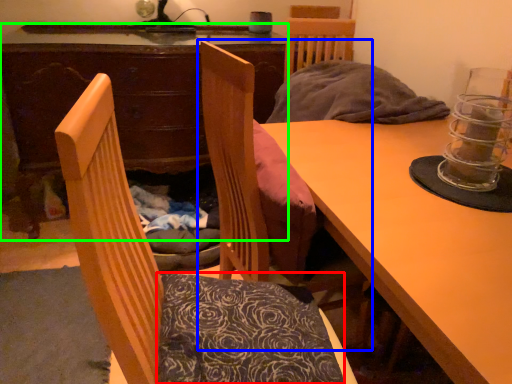
Question: Based on their relative distances, which object is nearer to pillow (highlighted by a red box)? Choose from chair (highlighted by a blue box) and desk (highlighted by a green box).

Choices:
 (A) chair
 (B) desk

Answer: (A)